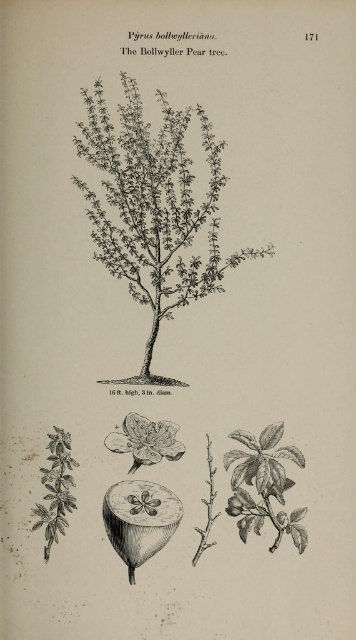
Question: Observing the image, what is the correct spatial positioning of black line drawing tree at center in reference to white paper-like at center?

Choices:
 (A) above
 (B) below

Answer: (A)

Question: Which object appears closest to the camera in this image?

Choices:
 (A) black line drawing tree at center
 (B) white paper-like at center

Answer: (A)

Question: Is black line drawing tree at center thinner than white paper-like at center?

Choices:
 (A) yes
 (B) no

Answer: (B)

Question: Which of the following is the closest to the observer?

Choices:
 (A) white paper-like at center
 (B) black line drawing tree at center

Answer: (B)

Question: Does black line drawing tree at center come behind white paper-like at center?

Choices:
 (A) no
 (B) yes

Answer: (A)

Question: Among these objects, which one is farthest from the camera?

Choices:
 (A) white paper-like at center
 (B) black line drawing tree at center

Answer: (A)